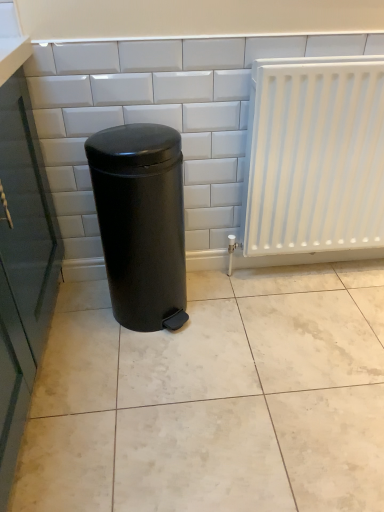
Image resolution: width=384 pixels, height=512 pixels. I want to click on vacant space situated on the left part of black matte waste container at center, so click(82, 321).